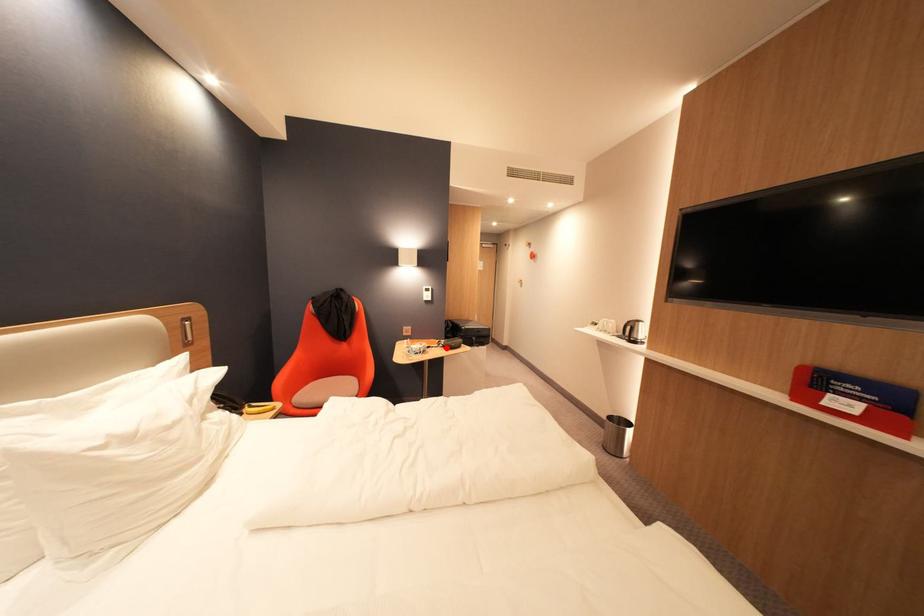
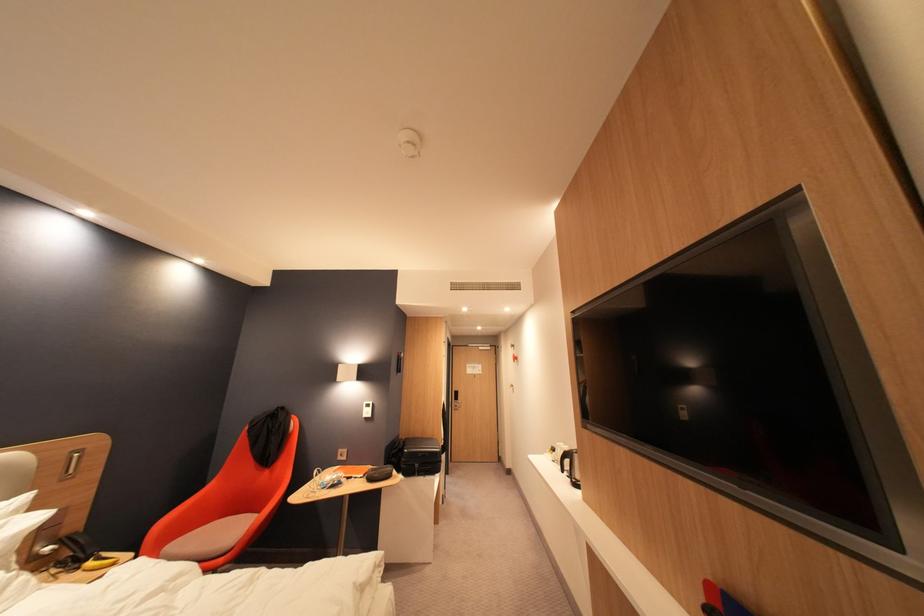
Find the pixel in the second image that matches the highlighted location in the first image.

(371, 477)